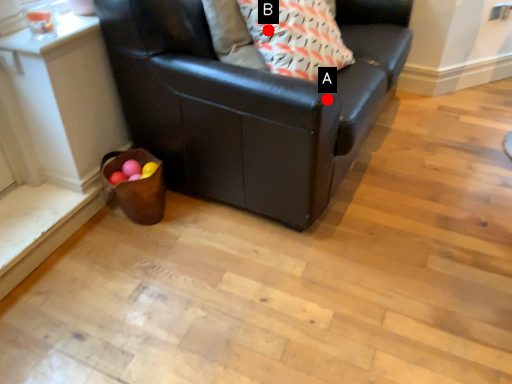
Question: Two points are circled on the image, labeled by A and B beside each circle. Which point is closer to the camera?

Choices:
 (A) A is closer
 (B) B is closer

Answer: (A)